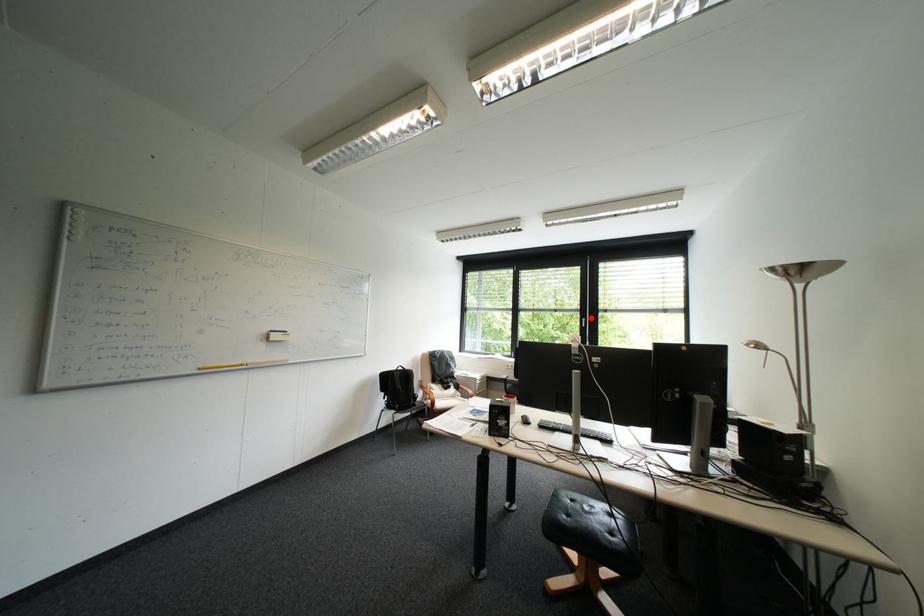
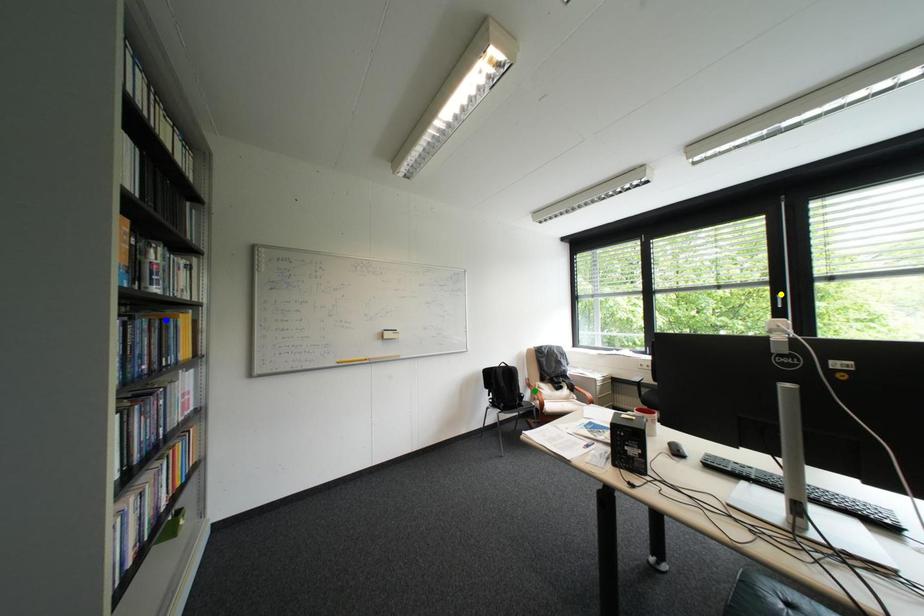
Question: I am providing you with two images of the same scene from different viewpoints. A red point is marked on the first image. You are given multiple points on the second image. Which point in image 2 is actually the same real-world point as the red point in image 1?

Choices:
 (A) green point
 (B) yellow point
 (C) blue point

Answer: (B)